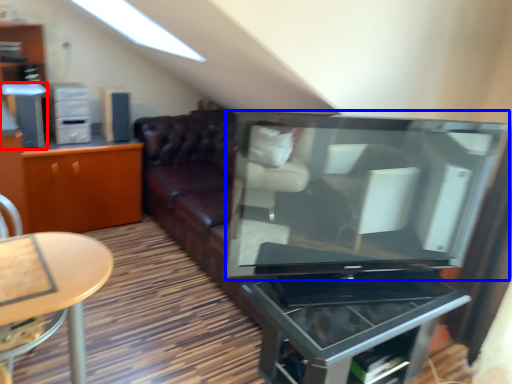
Question: Among these objects, which one is nearest to the camera, appliance (highlighted by a red box) or television (highlighted by a blue box)?

Choices:
 (A) appliance
 (B) television

Answer: (B)